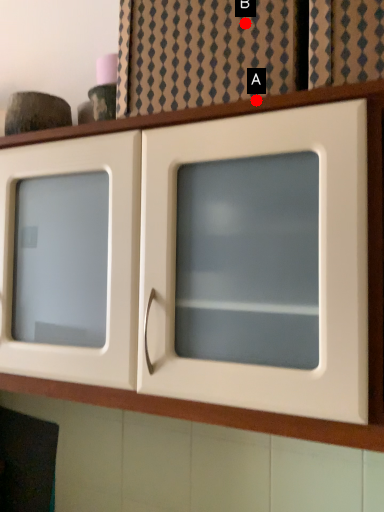
Question: Two points are circled on the image, labeled by A and B beside each circle. Which of the following is the farthest from the observer?

Choices:
 (A) A is further
 (B) B is further

Answer: (B)